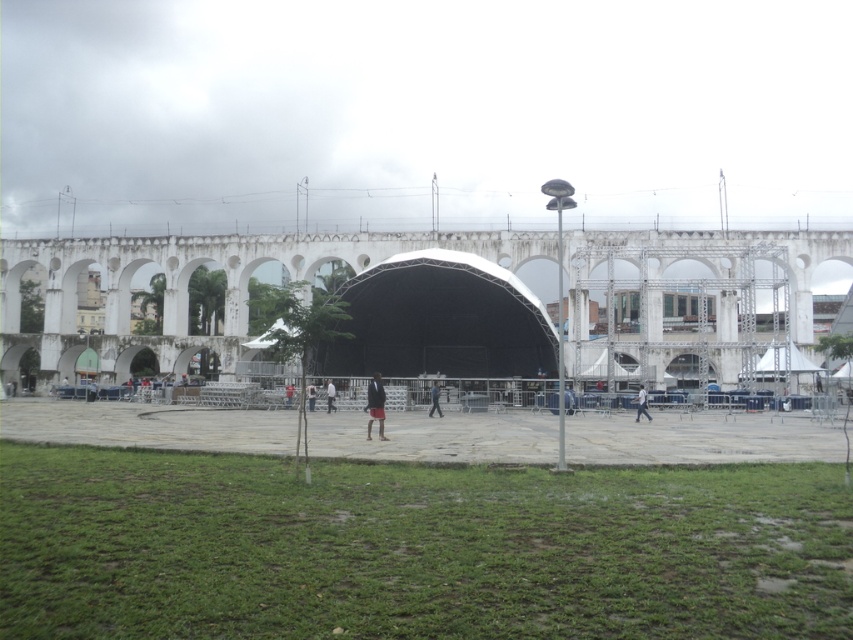
Question: Which object is positioned closest to the dark red fabric pants at center?

Choices:
 (A) light brown wooden stick at center
 (B) red fabric person at center
 (C) dark blue jeans at center
 (D) white fabric person at center

Answer: (C)

Question: Is black fabric amphitheater at center to the right of dark brown leather jacket at center from the viewer's perspective?

Choices:
 (A) yes
 (B) no

Answer: (B)

Question: Does light brown wooden stick at center appear on the right side of red fabric person at center?

Choices:
 (A) no
 (B) yes

Answer: (B)

Question: Among these points, which one is nearest to the camera?

Choices:
 (A) [292, 387]
 (B) [635, 400]
 (C) [312, 385]

Answer: (B)

Question: Which of the following is the closest to the observer?

Choices:
 (A) (641, 384)
 (B) (289, 403)

Answer: (B)

Question: Does dark blue jeans at center have a lesser width compared to light brown wooden stick at center?

Choices:
 (A) yes
 (B) no

Answer: (B)